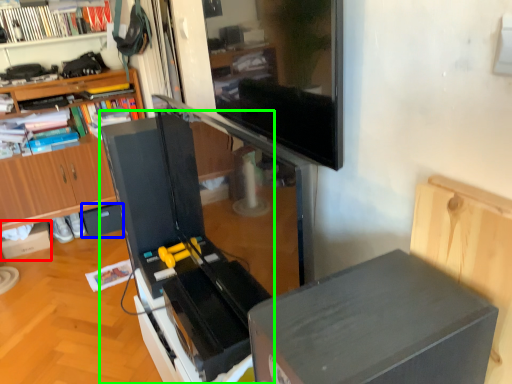
Question: Which object is positioned farthest from cardboard box (highlighted by a red box)? Select from drawer (highlighted by a blue box) and appliance (highlighted by a green box).

Choices:
 (A) drawer
 (B) appliance

Answer: (B)